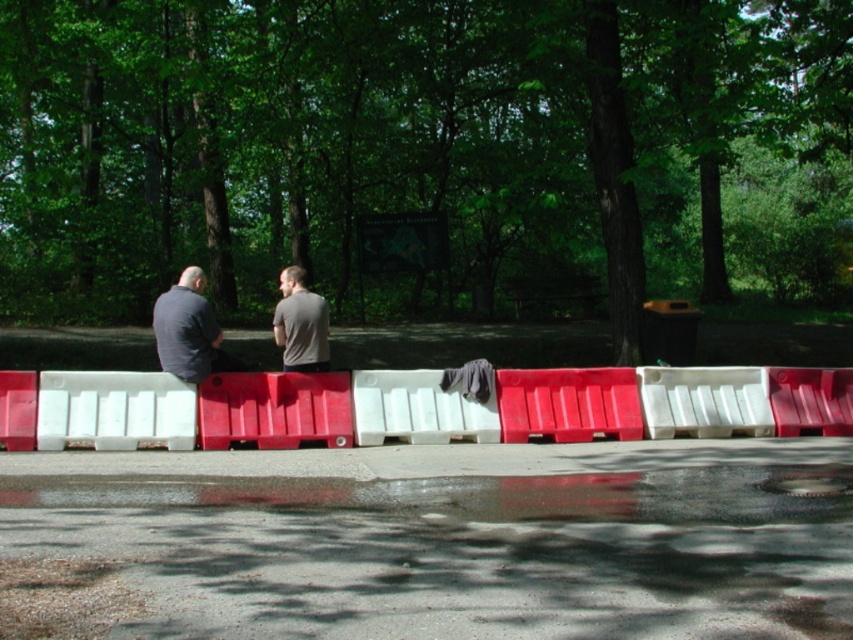
Question: Can you confirm if dark gray shirt at left is thinner than metallic red bench at lower right?

Choices:
 (A) no
 (B) yes

Answer: (B)

Question: Which of the following is the closest to the observer?

Choices:
 (A) metallic red bench at lower right
 (B) matte gray shirt at center
 (C) white plastic barrier at center

Answer: (C)

Question: Does white plastic barrier at center appear over matte gray shirt at center?

Choices:
 (A) yes
 (B) no

Answer: (B)

Question: Considering the relative positions of white plastic barrier at center and metallic red bench at lower right in the image provided, where is white plastic barrier at center located with respect to metallic red bench at lower right?

Choices:
 (A) above
 (B) below

Answer: (A)

Question: Which object is positioned closest to the matte gray shirt at center?

Choices:
 (A) dark gray shirt at left
 (B) metallic red bench at lower right

Answer: (A)

Question: Based on their relative distances, which object is farther from the metallic red bench at lower right?

Choices:
 (A) matte gray shirt at center
 (B) dark gray shirt at left

Answer: (B)